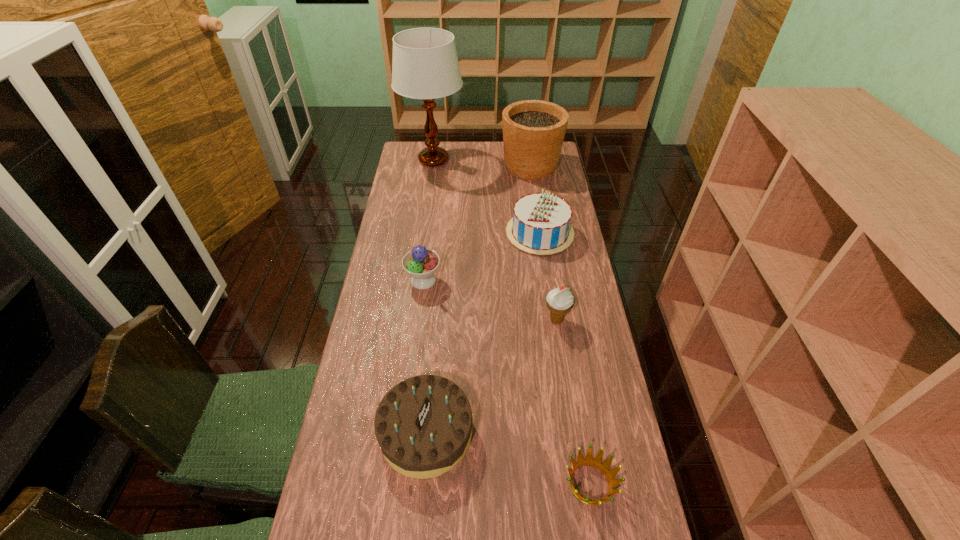
Identify the location of table lamp situated at the left edge. This screenshot has height=540, width=960. 425,65.

Find the location of a particular element. This screenshot has width=960, height=540. icecream that is at the left edge is located at coordinates (421, 263).

Where is `birthday cake that is at the left edge`? birthday cake that is at the left edge is located at coordinates (423, 425).

Locate an element on the screen. Image resolution: width=960 pixels, height=540 pixels. flowerpot located in the right edge section of the desktop is located at coordinates (533, 130).

Where is `icecream that is at the right edge`? icecream that is at the right edge is located at coordinates (560, 301).

Where is `birthday cake situated at the right edge`? birthday cake situated at the right edge is located at coordinates (540, 225).

Find the location of a particular element. The height and width of the screenshot is (540, 960). crown that is at the right edge is located at coordinates (596, 462).

This screenshot has height=540, width=960. I want to click on object present at the far left corner, so click(x=425, y=65).

Identify the location of object that is at the far right corner. (533, 130).

Image resolution: width=960 pixels, height=540 pixels. In order to click on free spot at the left edge of the desktop in this screenshot , I will do `click(398, 238)`.